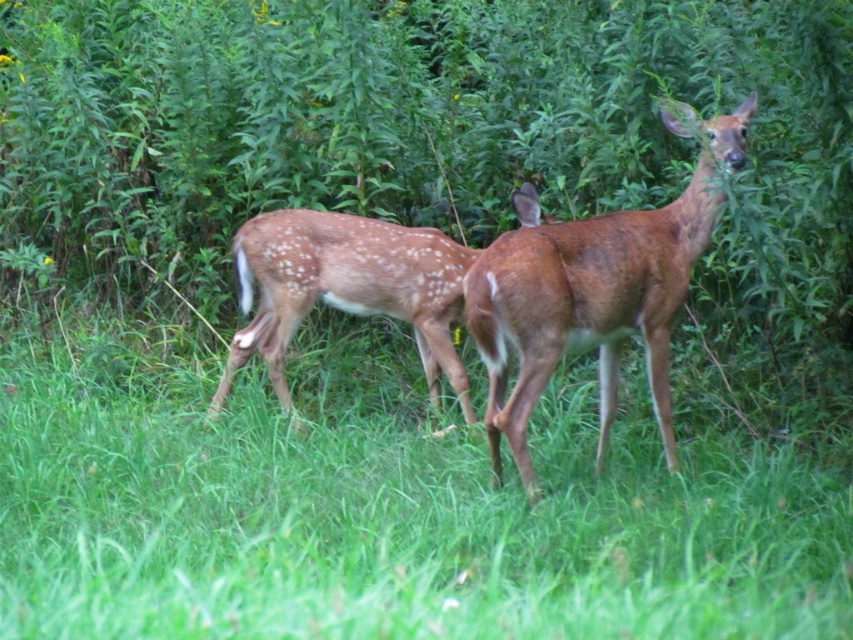
Can you confirm if brown matte/deer at center is positioned above brown speckled fur at center?

Indeed, brown matte/deer at center is positioned over brown speckled fur at center.

This screenshot has height=640, width=853. What are the coordinates of `brown matte/deer at center` in the screenshot? It's located at (595, 292).

Which is below, green grass at center or brown matte/deer at center?

green grass at center is below.

The height and width of the screenshot is (640, 853). What are the coordinates of `green grass at center` in the screenshot? It's located at (393, 497).

Where is `green grass at center`? The height and width of the screenshot is (640, 853). green grass at center is located at coordinates (393, 497).

Who is higher up, green grass at center or brown speckled fur at center?

brown speckled fur at center is higher up.

Find the location of a particular element. green grass at center is located at coordinates (393, 497).